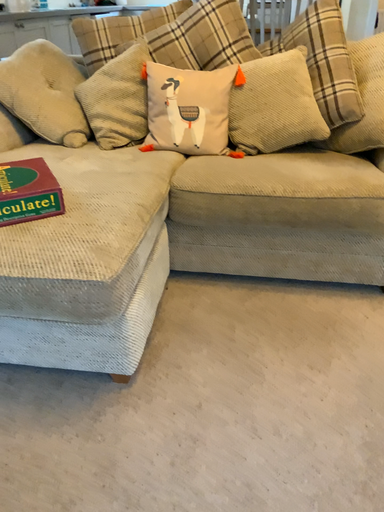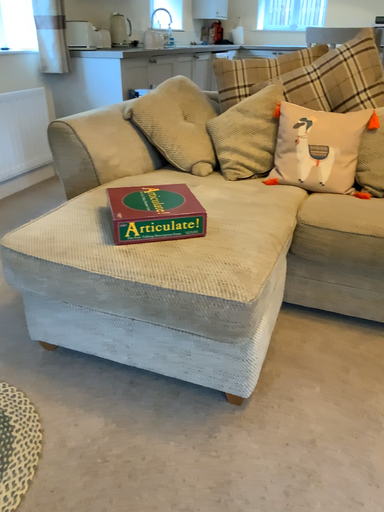
Question: Which way did the camera rotate in the video?

Choices:
 (A) rotated left
 (B) rotated right

Answer: (A)